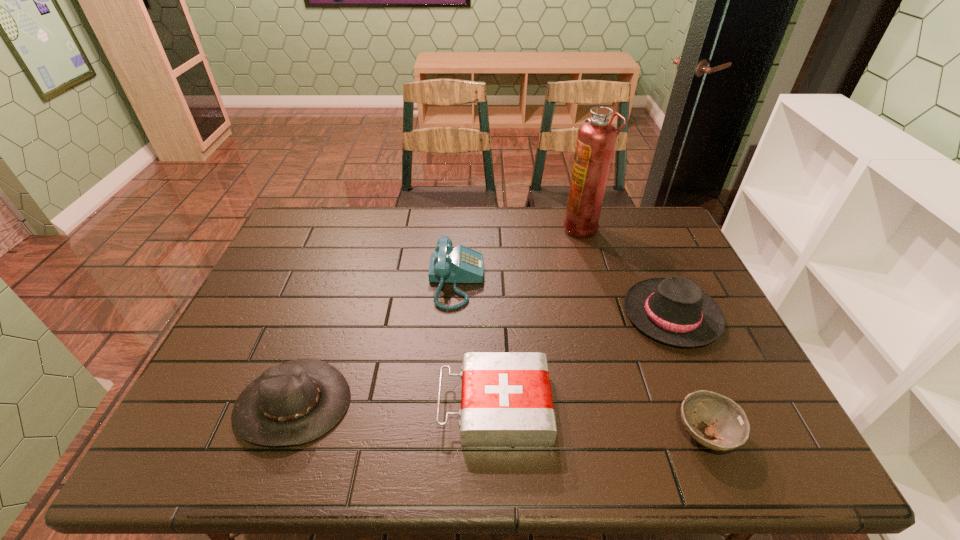
Find the location of a particular element. the farthest object is located at coordinates pos(596,138).

Locate an element on the screen. The width and height of the screenshot is (960, 540). the tallest object is located at coordinates (596, 138).

The height and width of the screenshot is (540, 960). Find the location of `dress hat`. dress hat is located at coordinates (674, 310).

Locate an element on the screen. The height and width of the screenshot is (540, 960). telephone is located at coordinates (461, 264).

Where is `the leftmost object`? the leftmost object is located at coordinates (296, 402).

Where is `the first-aid kit`? Image resolution: width=960 pixels, height=540 pixels. the first-aid kit is located at coordinates (506, 401).

Find the location of `bowl`. bowl is located at coordinates (727, 422).

The width and height of the screenshot is (960, 540). Identify the location of vacant area situated on the side of the farthest object with the label. (479, 227).

This screenshot has width=960, height=540. In order to click on free space located 0.340m on the side of the farthest object with the label in this screenshot , I will do `click(465, 227)`.

At what (x,y) coordinates should I click in order to perform the action: click on vacant region located on the side of the farthest object with the label. Please return your answer as a coordinate pair (x, y). Looking at the image, I should click on (454, 227).